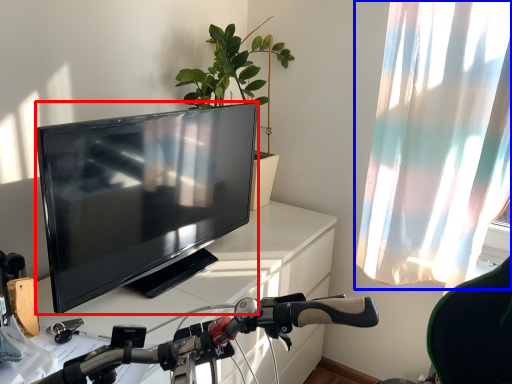
Question: Which object appears closest to the camera in this image, television (highlighted by a red box) or curtain (highlighted by a blue box)?

Choices:
 (A) television
 (B) curtain

Answer: (A)